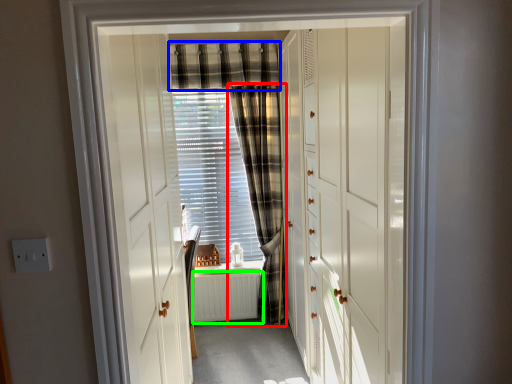
Question: Considering the real-world distances, which object is closest to curtain (highlighted by a red box)? curtain (highlighted by a blue box) or radiator (highlighted by a green box).

Choices:
 (A) curtain
 (B) radiator

Answer: (B)